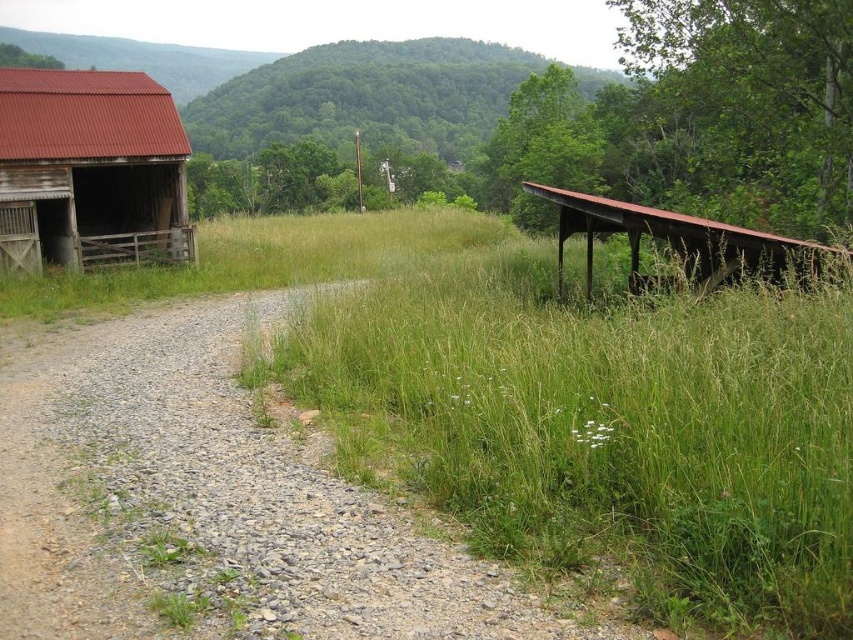
Find the location of `green grassy at center`. green grassy at center is located at coordinates (602, 424).

This screenshot has width=853, height=640. What do you see at coordinates (602, 424) in the screenshot? I see `green grassy at center` at bounding box center [602, 424].

This screenshot has height=640, width=853. I want to click on green grassy at center, so click(602, 424).

In the scene shown: Can you confirm if gray gravel at lower left is bigger than rusty metal shelter at right?

Actually, gray gravel at lower left might be smaller than rusty metal shelter at right.

I want to click on gray gravel at lower left, so click(210, 502).

Who is taller, green grassy at center or rusty corrugated metal barn at left?

Standing taller between the two is rusty corrugated metal barn at left.

Is green grassy at center wider than rusty corrugated metal barn at left?

Yes.

Locate an element on the screen. green grassy at center is located at coordinates (602, 424).